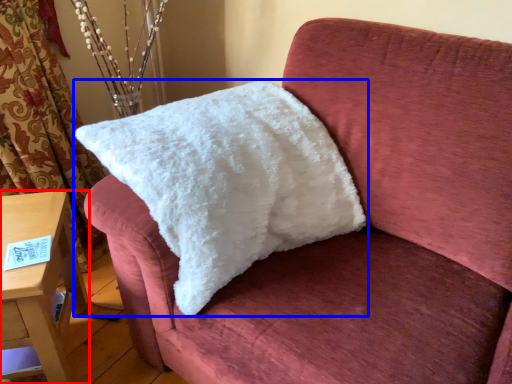
Question: Which point is further to the camera, furniture (highlighted by a red box) or pillow (highlighted by a blue box)?

Choices:
 (A) furniture
 (B) pillow

Answer: (A)